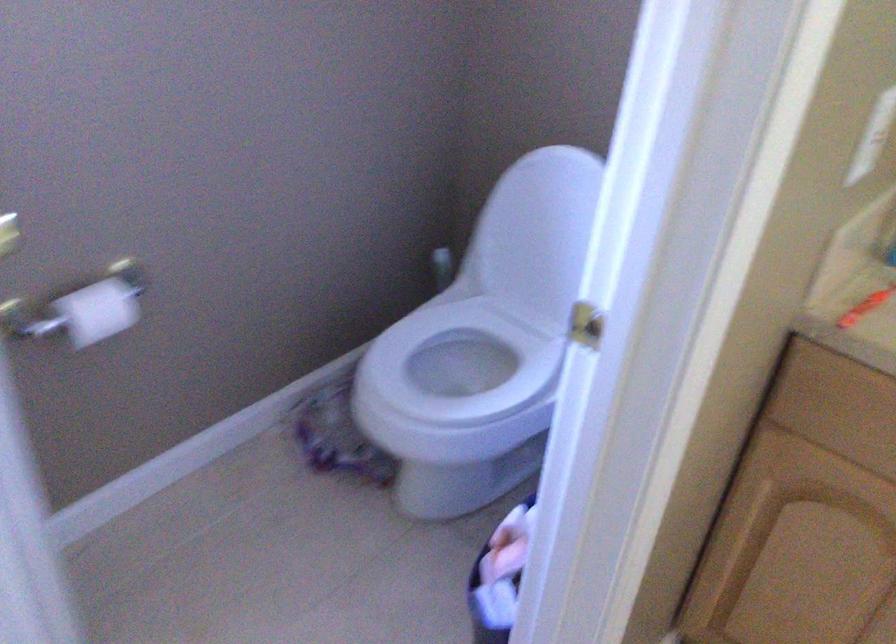
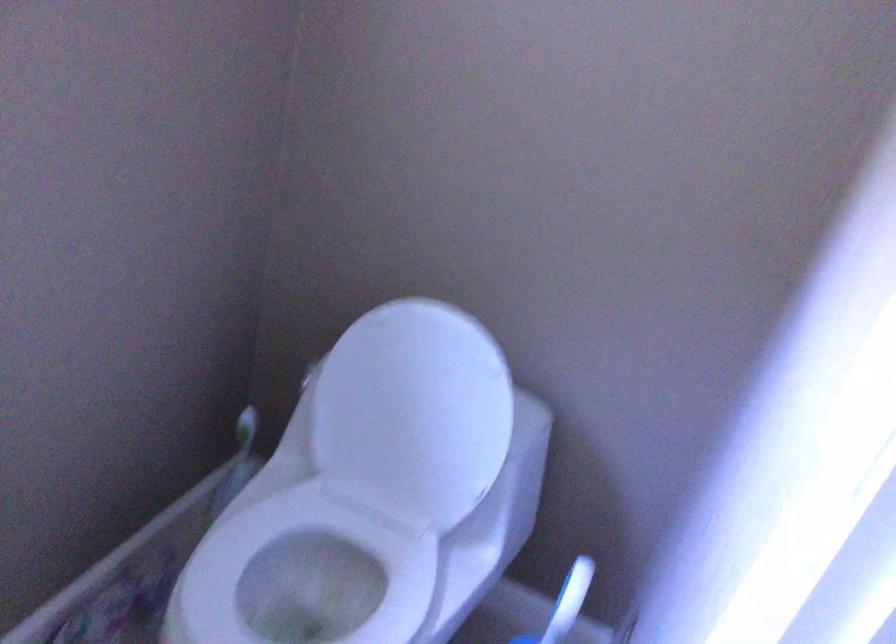
The images are taken continuously from a first-person perspective. In which direction are you moving?

The cameraman walked toward left, forward.